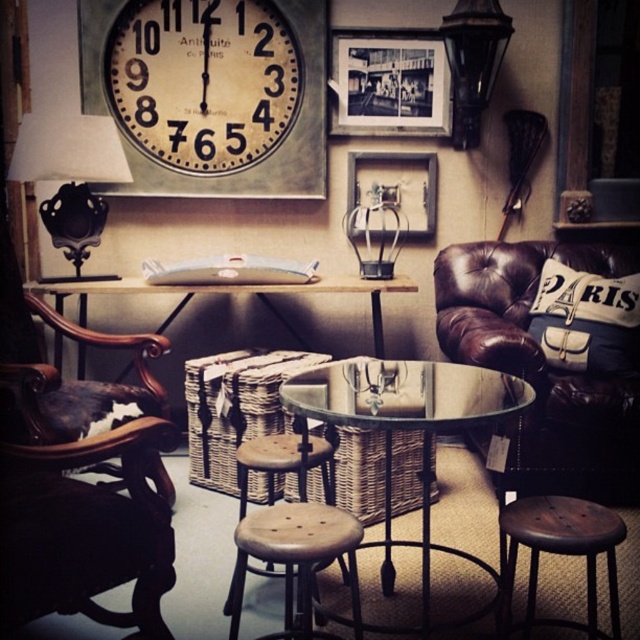
Question: Can you confirm if vintage cream clock at upper center is bigger than wooden bar stool at center?

Choices:
 (A) yes
 (B) no

Answer: (A)

Question: Which point appears farthest from the camera in this image?

Choices:
 (A) (362, 65)
 (B) (310, 448)

Answer: (A)

Question: Which point is closer to the camera?

Choices:
 (A) (612, 540)
 (B) (612, 360)
 (C) (428, 497)

Answer: (A)

Question: Can you confirm if vintage cream clock at upper center is positioned to the left of transparent glass table at center?

Choices:
 (A) no
 (B) yes

Answer: (B)

Question: Can you confirm if transparent glass table at center is wider than wooden bar stool at center?

Choices:
 (A) yes
 (B) no

Answer: (A)

Question: Which point is closer to the camera taking this photo?

Choices:
 (A) (611, 545)
 (B) (264, 449)
 (C) (140, 64)
 (D) (349, 177)

Answer: (A)